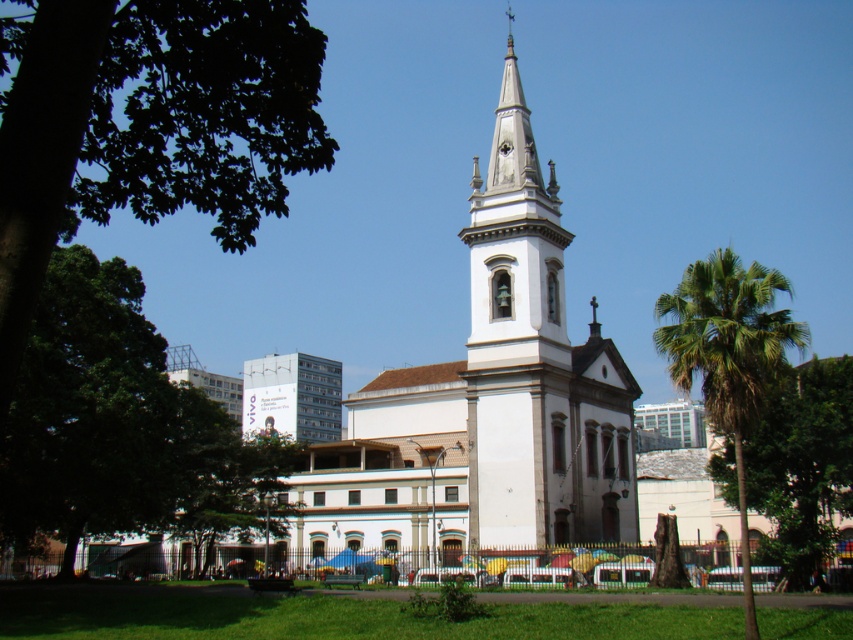
Can you confirm if white stone bell tower at center is shorter than green leafy tree at center?

In fact, white stone bell tower at center may be taller than green leafy tree at center.

Is white stone bell tower at center below green leafy tree at center?

Incorrect, white stone bell tower at center is not positioned below green leafy tree at center.

Does point (506, 244) come farther from viewer compared to point (769, 552)?

That is True.

Where is `white stone bell tower at center`? Image resolution: width=853 pixels, height=640 pixels. white stone bell tower at center is located at coordinates (517, 340).

Is white stone bell tower at center bigger than green leafy palm tree at right?

No.

Measure the distance between white stone bell tower at center and green leafy palm tree at right.

They are 18.64 meters apart.

Between point (485, 248) and point (798, 332), which one is positioned in front?

Positioned in front is point (798, 332).

What are the coordinates of `white stone bell tower at center` in the screenshot? It's located at (517, 340).

Is point (76, 292) closer to camera compared to point (474, 456)?

That is True.

Which is in front, point (74, 296) or point (486, 515)?

Positioned in front is point (74, 296).

Where is `green leafy tree at lower left`? This screenshot has width=853, height=640. green leafy tree at lower left is located at coordinates (115, 422).